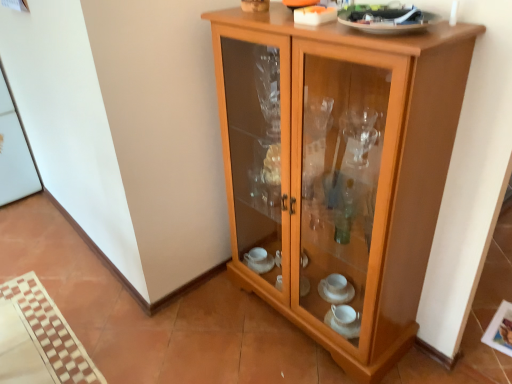
Locate an element on the screen. This screenshot has height=384, width=512. free space to the left of wooden cabinet at center is located at coordinates (205, 327).